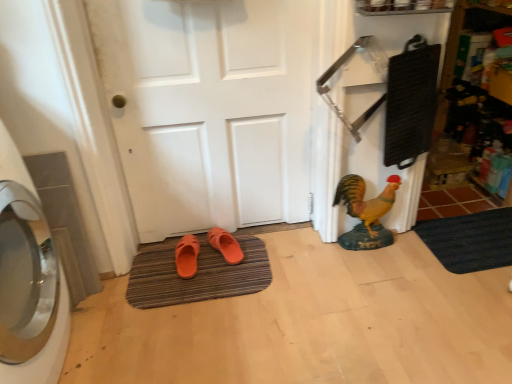
Find the location of a particular element. The image size is (512, 384). unoccupied region to the right of orange matte slippers at center, the 1th footwear viewed from the right is located at coordinates (252, 253).